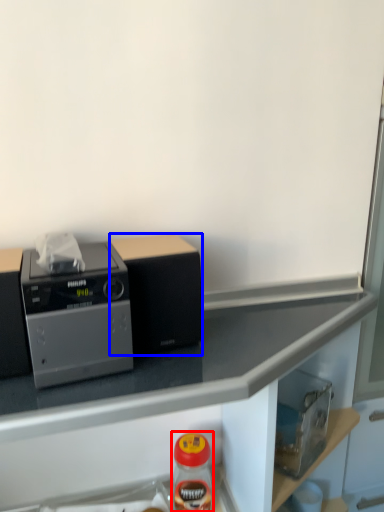
Question: Which of the following is the closest to the observer, bottle (highlighted by a red box) or appliance (highlighted by a blue box)?

Choices:
 (A) bottle
 (B) appliance

Answer: (B)